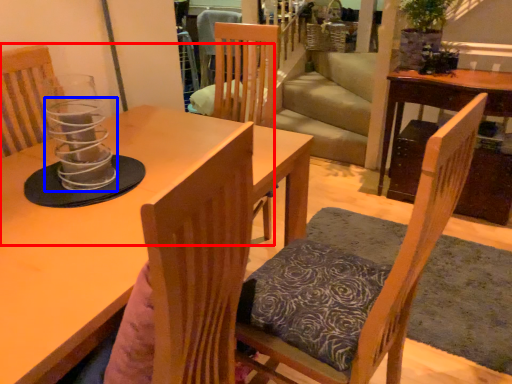
Question: Which point is further to the camera, chair (highlighted by a red box) or candle holder (highlighted by a blue box)?

Choices:
 (A) chair
 (B) candle holder

Answer: (A)